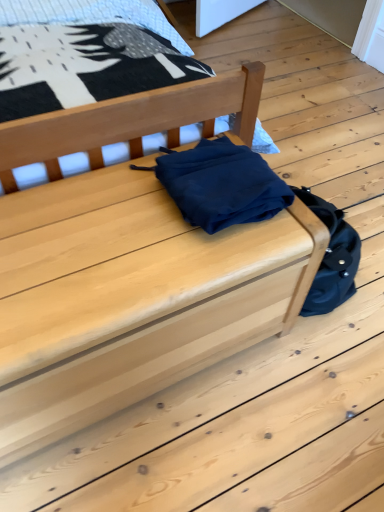
Question: Can you confirm if matte wood chest at center, the 2th furniture from the top, is thinner than matte wood chest at center, placed as the second furniture when sorted from bottom to top?

Choices:
 (A) no
 (B) yes

Answer: (B)

Question: Does matte wood chest at center, arranged as the 1th furniture when ordered from the bottom, have a greater width compared to matte wood chest at center, placed as the second furniture when sorted from bottom to top?

Choices:
 (A) no
 (B) yes

Answer: (A)

Question: Is matte wood chest at center, arranged as the 1th furniture when ordered from the bottom, with matte wood chest at center, which is counted as the first furniture, starting from the top?

Choices:
 (A) no
 (B) yes

Answer: (A)

Question: Would you consider matte wood chest at center, the 2th furniture from the top, to be distant from matte wood chest at center, which is counted as the first furniture, starting from the top?

Choices:
 (A) no
 (B) yes

Answer: (A)

Question: From the image's perspective, is matte wood chest at center, arranged as the 1th furniture when ordered from the bottom, located beneath matte wood chest at center, placed as the second furniture when sorted from bottom to top?

Choices:
 (A) no
 (B) yes

Answer: (B)

Question: Can you confirm if matte wood chest at center, the 2th furniture from the top, is shorter than matte wood chest at center, which is counted as the first furniture, starting from the top?

Choices:
 (A) no
 (B) yes

Answer: (B)

Question: From the image's perspective, does matte wood chest at center, which is counted as the first furniture, starting from the top, appear higher than matte wood chest at center, arranged as the 1th furniture when ordered from the bottom?

Choices:
 (A) no
 (B) yes

Answer: (B)

Question: Are matte wood chest at center, placed as the second furniture when sorted from bottom to top, and matte wood chest at center, arranged as the 1th furniture when ordered from the bottom, located far from each other?

Choices:
 (A) no
 (B) yes

Answer: (A)

Question: Can you confirm if matte wood chest at center, placed as the second furniture when sorted from bottom to top, is smaller than matte wood chest at center, the 2th furniture from the top?

Choices:
 (A) no
 (B) yes

Answer: (A)

Question: From the image's perspective, does matte wood chest at center, which is counted as the first furniture, starting from the top, appear lower than matte wood chest at center, arranged as the 1th furniture when ordered from the bottom?

Choices:
 (A) no
 (B) yes

Answer: (A)

Question: Is matte wood chest at center, which is counted as the first furniture, starting from the top, to the left of matte wood chest at center, arranged as the 1th furniture when ordered from the bottom, from the viewer's perspective?

Choices:
 (A) no
 (B) yes

Answer: (B)

Question: Does matte wood chest at center, which is counted as the first furniture, starting from the top, have a greater width compared to matte wood chest at center, arranged as the 1th furniture when ordered from the bottom?

Choices:
 (A) yes
 (B) no

Answer: (A)

Question: Based on their sizes in the image, would you say matte wood chest at center, arranged as the 1th furniture when ordered from the bottom, is bigger or smaller than matte wood chest at center, placed as the second furniture when sorted from bottom to top?

Choices:
 (A) big
 (B) small

Answer: (B)